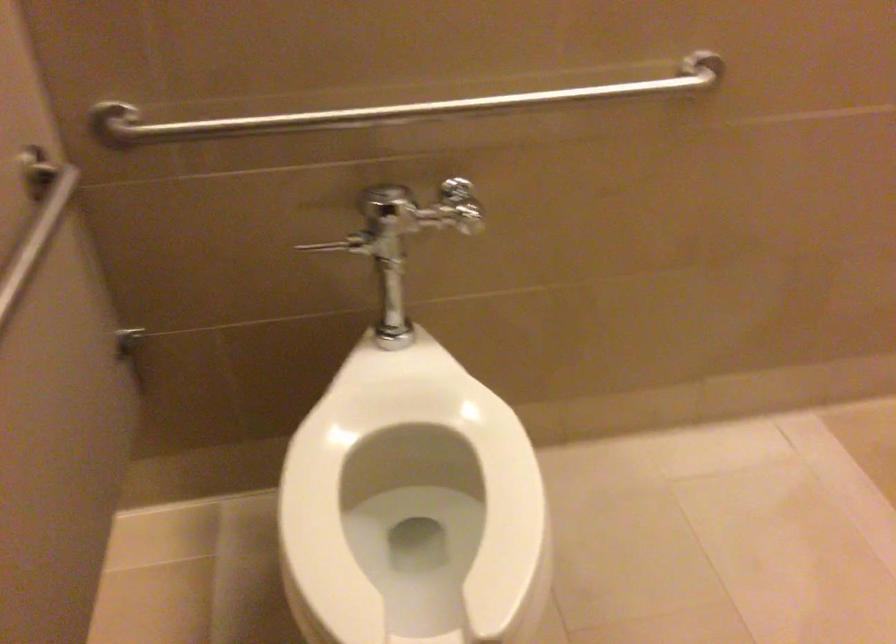
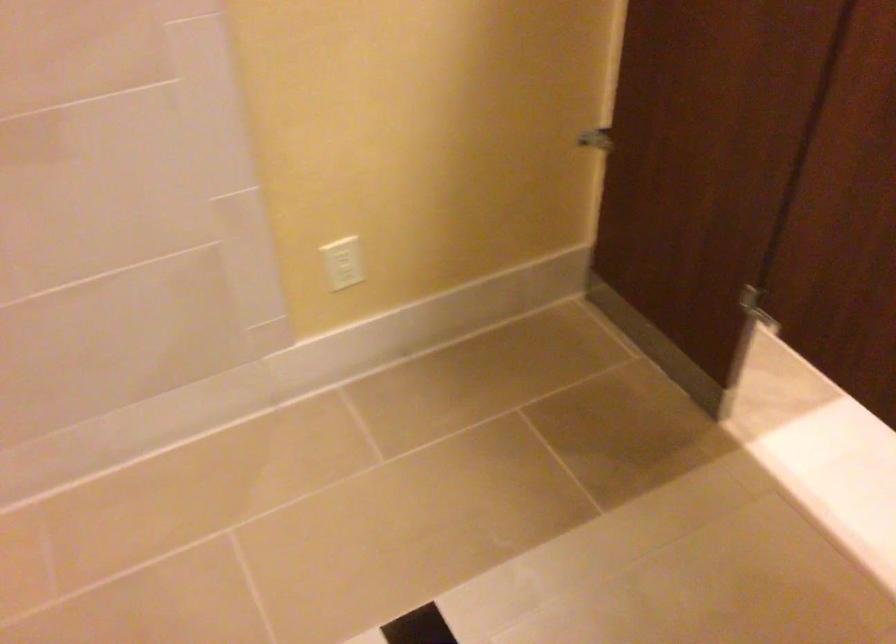
The images are taken continuously from a first-person perspective. In which direction is your viewpoint rotating?

The camera rotated toward right-down.